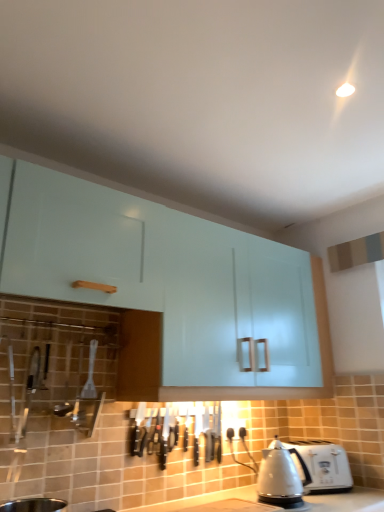
Question: From the image's perspective, is satin silver kettle at lower right above white plastic toaster at lower right?

Choices:
 (A) no
 (B) yes

Answer: (B)

Question: Does satin silver kettle at lower right lie in front of white plastic toaster at lower right?

Choices:
 (A) yes
 (B) no

Answer: (A)

Question: Is satin silver kettle at lower right shorter than white plastic toaster at lower right?

Choices:
 (A) no
 (B) yes

Answer: (A)

Question: Is satin silver kettle at lower right facing away from white plastic toaster at lower right?

Choices:
 (A) yes
 (B) no

Answer: (B)

Question: Does satin silver kettle at lower right lie behind white plastic toaster at lower right?

Choices:
 (A) yes
 (B) no

Answer: (B)

Question: Is satin silver kettle at lower right taller than white plastic toaster at lower right?

Choices:
 (A) no
 (B) yes

Answer: (B)

Question: Is glossy white cabinet at upper center wider than white plastic toaster at lower right?

Choices:
 (A) no
 (B) yes

Answer: (B)

Question: Does glossy white cabinet at upper center have a lesser height compared to white plastic toaster at lower right?

Choices:
 (A) no
 (B) yes

Answer: (A)

Question: From a real-world perspective, is glossy white cabinet at upper center located higher than white plastic toaster at lower right?

Choices:
 (A) no
 (B) yes

Answer: (B)

Question: Is glossy white cabinet at upper center positioned behind white plastic toaster at lower right?

Choices:
 (A) yes
 (B) no

Answer: (B)

Question: From a real-world perspective, is glossy white cabinet at upper center under white plastic toaster at lower right?

Choices:
 (A) no
 (B) yes

Answer: (A)

Question: Is the position of glossy white cabinet at upper center less distant than that of white plastic toaster at lower right?

Choices:
 (A) yes
 (B) no

Answer: (A)

Question: Considering the relative sizes of satin silver kettle at lower right and glossy white cabinet at upper center in the image provided, is satin silver kettle at lower right smaller than glossy white cabinet at upper center?

Choices:
 (A) yes
 (B) no

Answer: (A)